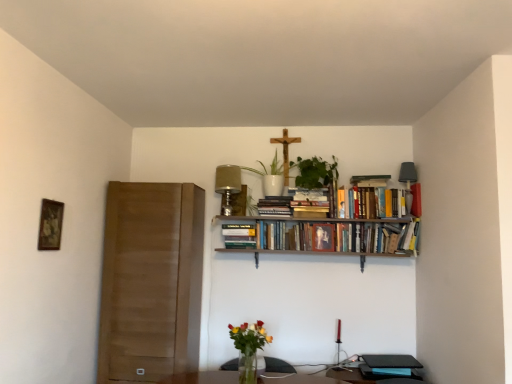
The width and height of the screenshot is (512, 384). Describe the element at coordinates (334, 236) in the screenshot. I see `hardcover books at center, which ranks as the 4th book in right-to-left order` at that location.

The width and height of the screenshot is (512, 384). Identify the location of hardcover books at center, which ranks as the 4th book in right-to-left order. (334, 236).

This screenshot has height=384, width=512. What do you see at coordinates (239, 236) in the screenshot? I see `hardcover book at center, the 5th book positioned from the right` at bounding box center [239, 236].

Measure the distance between white ceramic pot at upper center, placed as the first plant when sorted from left to right, and camera.

white ceramic pot at upper center, placed as the first plant when sorted from left to right, and camera are 3.30 meters apart from each other.

In order to face wooden crucifix at upper center, should I rotate leftwards or rightwards?

Rotate your view right by about 4.177°.

What do you see at coordinates (285, 152) in the screenshot? Image resolution: width=512 pixels, height=384 pixels. I see `wooden crucifix at upper center` at bounding box center [285, 152].

This screenshot has width=512, height=384. What do you see at coordinates (374, 199) in the screenshot?
I see `hardcover books at upper center, which ranks as the 3th book in left-to-right order` at bounding box center [374, 199].

Locate an element on the screen. The image size is (512, 384). hardcover books at center, which ranks as the 4th book in right-to-left order is located at coordinates (334, 236).

In the scene shown: Which of these two, hardcover books at center, positioned as the second book in left-to-right order, or wooden picture frame at left, stands shorter?

With less height is hardcover books at center, positioned as the second book in left-to-right order.

You are a GUI agent. You are given a task and a screenshot of the screen. Output one action in this format:
    pyautogui.click(x=<x>, y=<y>)
    Task: Click on the picture frame above the hardcover books at center, which ranks as the 4th book in right-to-left order (from a real-world perspective)
    This screenshot has height=384, width=512.
    Given the screenshot: What is the action you would take?
    pyautogui.click(x=50, y=225)

Is hardcover books at center, which ranks as the 4th book in right-to-left order, looking in the opposite direction of wooden picture frame at left?

That's not correct — hardcover books at center, which ranks as the 4th book in right-to-left order, is not looking away from wooden picture frame at left.

How different are the orientations of hardcover books at center, positioned as the second book in left-to-right order, and wooden picture frame at left in degrees?

They differ by 92.3 degrees in their facing directions.

From a real-world perspective, which is physically above, hardcover book at upper right, which is counted as the fifth book, starting from the left, or wooden picture frame at left?

hardcover book at upper right, which is counted as the fifth book, starting from the left.

Considering the relative sizes of hardcover book at upper right, the 1th book when ordered from right to left, and wooden picture frame at left in the image provided, is hardcover book at upper right, the 1th book when ordered from right to left, shorter than wooden picture frame at left?

Indeed, hardcover book at upper right, the 1th book when ordered from right to left, has a lesser height compared to wooden picture frame at left.

Find the location of `the 2nd book located above the wooden picture frame at left (from a real-world perspective)`. the 2nd book located above the wooden picture frame at left (from a real-world perspective) is located at coordinates (416, 200).

Considering the sizes of objects hardcover book at upper right, which is counted as the fifth book, starting from the left, and wooden picture frame at left in the image provided, who is smaller, hardcover book at upper right, which is counted as the fifth book, starting from the left, or wooden picture frame at left?

wooden picture frame at left.

Is wooden crucifix at upper center wider or thinner than hardcover books at upper center, which is the third book from right to left?

Considering their sizes, wooden crucifix at upper center looks slimmer than hardcover books at upper center, which is the third book from right to left.

Considering the sizes of wooden crucifix at upper center and hardcover books at upper center, which ranks as the 3th book in left-to-right order, in the image, is wooden crucifix at upper center taller or shorter than hardcover books at upper center, which ranks as the 3th book in left-to-right order,?

wooden crucifix at upper center is taller than hardcover books at upper center, which ranks as the 3th book in left-to-right order.

Which object is positioned more to the right, wooden crucifix at upper center or hardcover books at upper center, which ranks as the 3th book in left-to-right order?

From the viewer's perspective, hardcover books at upper center, which ranks as the 3th book in left-to-right order, appears more on the right side.

Considering the positions of point (284, 133) and point (371, 182), is point (284, 133) closer or farther from the camera than point (371, 182)?

Point (284, 133) appears to be farther away from the viewer than point (371, 182).

Which is nearer, (287,199) or (305,171)?

A: The point (287,199) is more forward.

Is hardcover books at upper center oriented away from green leafy plant at upper center, which appears as the second plant when viewed from the left?

hardcover books at upper center does not have its back to green leafy plant at upper center, which appears as the second plant when viewed from the left.

Considering the sizes of hardcover books at upper center and green leafy plant at upper center, which appears as the second plant when viewed from the left, in the image, is hardcover books at upper center taller or shorter than green leafy plant at upper center, which appears as the second plant when viewed from the left,?

hardcover books at upper center is shorter than green leafy plant at upper center, which appears as the second plant when viewed from the left.

This screenshot has width=512, height=384. In order to click on the 1st plant above the hardcover books at upper center (from a real-world perspective) in this screenshot , I will do `click(315, 172)`.

Is wooden crucifix at upper center oriented away from wooden picture frame at left?

wooden crucifix at upper center does not have its back to wooden picture frame at left.

Does wooden crucifix at upper center have a greater height compared to wooden picture frame at left?

Yes, wooden crucifix at upper center is taller than wooden picture frame at left.

Considering the positions of objects wooden crucifix at upper center and wooden picture frame at left in the image provided, who is more to the left, wooden crucifix at upper center or wooden picture frame at left?

Positioned to the left is wooden picture frame at left.

From their relative heights in the image, would you say wooden crucifix at upper center is taller or shorter than hardcover book at upper right, the 1th book when ordered from right to left?

Considering their sizes, wooden crucifix at upper center has more height than hardcover book at upper right, the 1th book when ordered from right to left.

Identify the location of book that is the 2nd object located in front of the wooden crucifix at upper center. This screenshot has width=512, height=384. (416, 200).

Is point (287, 172) farther from camera compared to point (413, 192)?

Yes.

From the picture: From a real-world perspective, is wooden crucifix at upper center on top of hardcover book at upper right, the 1th book when ordered from right to left?

Yes.

Based on the photo, from the image's perspective, is hardcover book at center, which is the first book from left to right, located above translucent glass vase at lower center?

Yes, from the image's perspective, hardcover book at center, which is the first book from left to right, is on top of translucent glass vase at lower center.

Can you confirm if hardcover book at center, which is the first book from left to right, is positioned to the right of translucent glass vase at lower center?

Incorrect, hardcover book at center, which is the first book from left to right, is not on the right side of translucent glass vase at lower center.

Considering the sizes of objects hardcover book at center, the 5th book positioned from the right, and translucent glass vase at lower center in the image provided, who is smaller, hardcover book at center, the 5th book positioned from the right, or translucent glass vase at lower center?

Smaller between the two is hardcover book at center, the 5th book positioned from the right.

Could you tell me if hardcover book at center, which is the first book from left to right, is facing translucent glass vase at lower center?

No, hardcover book at center, which is the first book from left to right, is not aimed at translucent glass vase at lower center.

Find the location of a particular element. picture frame in front of the hardcover books at center, which ranks as the 4th book in right-to-left order is located at coordinates (50, 225).

The image size is (512, 384). In order to click on the 4th book behind the wooden picture frame at left, counting from the anchor's position in this screenshot , I will do `click(416, 200)`.

When comparing their distances from white ceramic pot at upper center, marked as the 2th plant in a right-to-left arrangement, does hardcover books at upper center, which ranks as the 3th book in left-to-right order, or wooden crucifix at upper center seem closer?

wooden crucifix at upper center.

From the picture: Based on their spatial positions, is hardcover books at upper center, which ranks as the 3th book in left-to-right order, or wooden picture frame at left closer to hardcover books at upper center?

Among the two, hardcover books at upper center, which ranks as the 3th book in left-to-right order, is located nearer to hardcover books at upper center.

From the image, which object appears to be farther from translucent glass vase at lower center, hardcover book at center, the 5th book positioned from the right, or hardcover books at center, positioned as the second book in left-to-right order?

Based on the image, hardcover books at center, positioned as the second book in left-to-right order, appears to be further to translucent glass vase at lower center.

Estimate the real-world distances between objects in this image. Which object is closer to hardcover books at center, which ranks as the 4th book in right-to-left order, hardcover book at upper right, the 1th book when ordered from right to left, or hardcover books at upper center, which is the third book from right to left?

The object closer to hardcover books at center, which ranks as the 4th book in right-to-left order, is hardcover books at upper center, which is the third book from right to left.

From the image, which object appears to be nearer to hardcover book at center, which is the first book from left to right, hardcover books at upper center, which is the third book from right to left, or hardcover books at center, which ranks as the 4th book in right-to-left order?

hardcover books at center, which ranks as the 4th book in right-to-left order.

Which object lies further to the anchor point translucent glass vase at lower center, wooden crucifix at upper center or white ceramic pot at upper center, marked as the 2th plant in a right-to-left arrangement?

Based on the image, wooden crucifix at upper center appears to be further to translucent glass vase at lower center.

Based on their spatial positions, is wooden crucifix at upper center or hardcover books at upper center further from hardcover books at upper center, the 2th book in the right-to-left sequence?

hardcover books at upper center lies further to hardcover books at upper center, the 2th book in the right-to-left sequence, than the other object.

From the image, which object appears to be farther from wooden picture frame at left, translucent glass vase at lower center or white ceramic pot at upper center, marked as the 2th plant in a right-to-left arrangement?

Based on the image, white ceramic pot at upper center, marked as the 2th plant in a right-to-left arrangement, appears to be further to wooden picture frame at left.

The height and width of the screenshot is (384, 512). Find the location of `paperback book between wooden picture frame at left and hardcover book at upper right, which is counted as the fifth book, starting from the left`. paperback book between wooden picture frame at left and hardcover book at upper right, which is counted as the fifth book, starting from the left is located at coordinates (275, 206).

Image resolution: width=512 pixels, height=384 pixels. In order to click on plant between white ceramic pot at upper center, placed as the first plant when sorted from left to right, and hardcover book at upper right, which is counted as the fifth book, starting from the left, from left to right in this screenshot , I will do `click(315, 172)`.

The height and width of the screenshot is (384, 512). What are the coordinates of `floral arrangement located between wooden picture frame at left and hardcover books at center, positioned as the second book in left-to-right order, in the left-right direction` in the screenshot? It's located at (248, 348).

Find the location of a particular element. paperback book between wooden picture frame at left and hardcover books at upper center, positioned as the fourth book in left-to-right order is located at coordinates (275, 206).